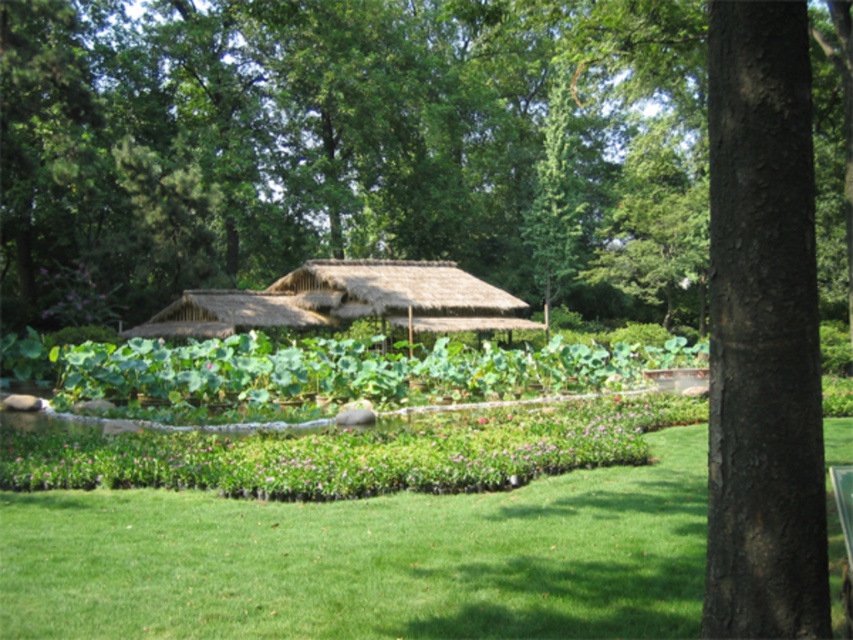
Question: Is green grass at lower center positioned at the back of thatched straw hut at center?

Choices:
 (A) no
 (B) yes

Answer: (A)

Question: Can you confirm if green grass at lower center is thinner than thatched straw hut at center?

Choices:
 (A) no
 (B) yes

Answer: (A)

Question: Based on their relative distances, which object is farther from the green grass at lower center?

Choices:
 (A) dark brown textured tree trunk at center right
 (B) thatched straw hut at center

Answer: (B)

Question: Which point appears closest to the camera in this image?

Choices:
 (A) (785, 340)
 (B) (467, 618)

Answer: (A)

Question: Which object appears closest to the camera in this image?

Choices:
 (A) dark brown textured tree trunk at center right
 (B) green grass at lower center

Answer: (A)

Question: Considering the relative positions of green grass at lower center and dark brown textured tree trunk at center right in the image provided, where is green grass at lower center located with respect to dark brown textured tree trunk at center right?

Choices:
 (A) left
 (B) right

Answer: (A)